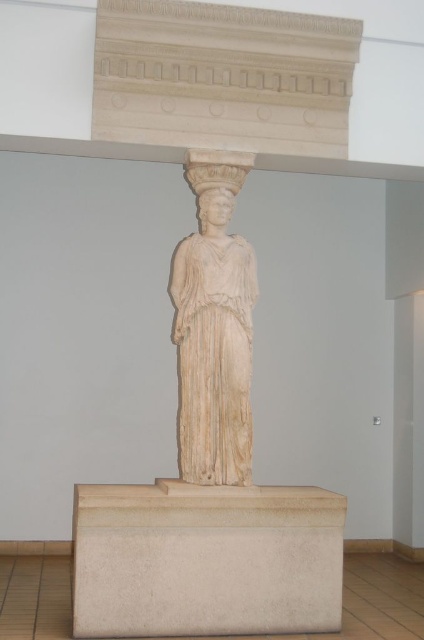
Question: Is the position of white marble pedestal at center more distant than that of white marble statue at center?

Choices:
 (A) no
 (B) yes

Answer: (A)

Question: Which point appears farthest from the camera in this image?

Choices:
 (A) (198, 353)
 (B) (245, 538)

Answer: (A)

Question: Can you confirm if white marble pedestal at center is positioned below white marble statue at center?

Choices:
 (A) yes
 (B) no

Answer: (A)

Question: Does white marble pedestal at center appear under white marble statue at center?

Choices:
 (A) no
 (B) yes

Answer: (B)